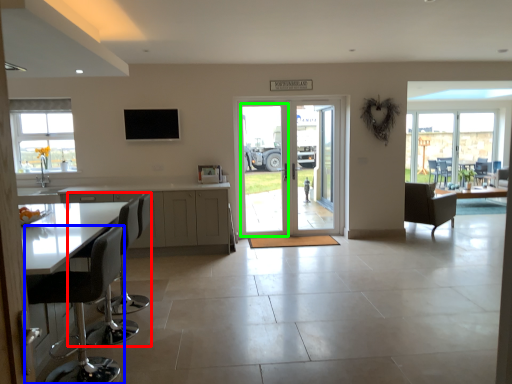
Question: Which object is the farthest from chair (highlighted by a red box)? Choose among these: chair (highlighted by a blue box) or screen door (highlighted by a green box).

Choices:
 (A) chair
 (B) screen door

Answer: (B)